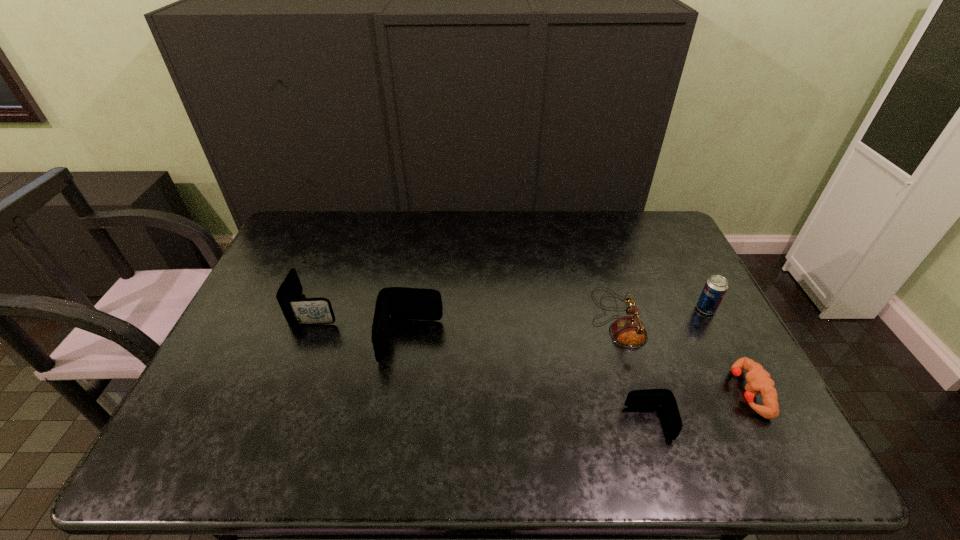
At what (x,y) coordinates should I click in order to perform the action: click on wallet present at the near edge. Please return your answer as a coordinate pair (x, y). This screenshot has height=540, width=960. Looking at the image, I should click on (648, 398).

At what (x,y) coordinates should I click in order to perform the action: click on puncher that is at the near edge. Please return your answer as a coordinate pair (x, y). Looking at the image, I should click on (759, 380).

Image resolution: width=960 pixels, height=540 pixels. What are the coordinates of `object that is positioned at the left edge` in the screenshot? It's located at [x=297, y=311].

Locate an element on the screen. The image size is (960, 540). beer can situated at the right edge is located at coordinates (716, 286).

Find the location of `puncher located in the right edge section of the desktop`. puncher located in the right edge section of the desktop is located at coordinates (759, 380).

Locate an element on the screen. object located at the near right corner is located at coordinates (759, 380).

Where is `vacant region at the far edge of the desktop`? vacant region at the far edge of the desktop is located at coordinates (552, 212).

What are the coordinates of `vacant space at the near edge` in the screenshot? It's located at (435, 416).

This screenshot has width=960, height=540. In order to click on vacant region at the left edge in this screenshot , I will do `click(239, 385)`.

The height and width of the screenshot is (540, 960). I want to click on blank space at the far right corner of the desktop, so click(677, 244).